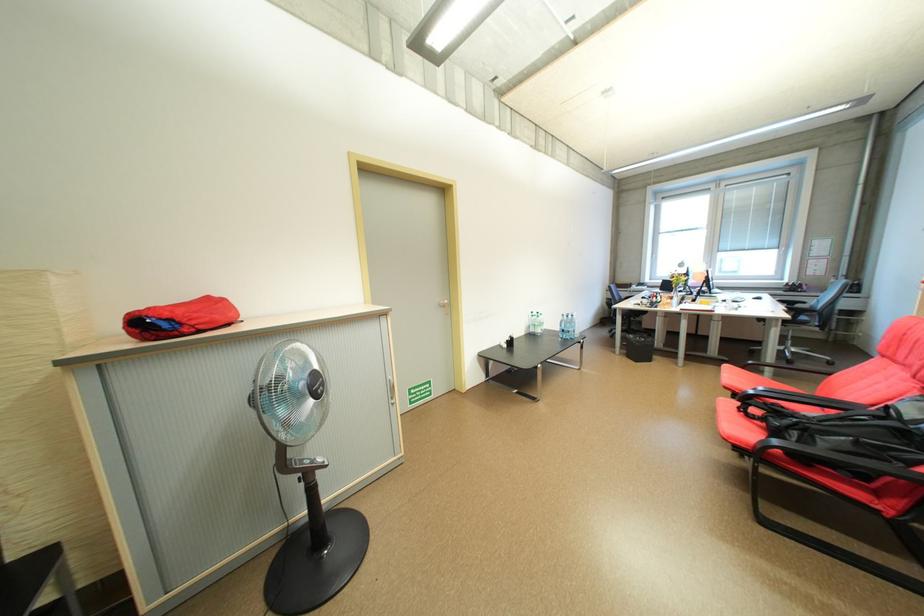
At what (x,y) coordinates should I click in order to perform the action: click on computer keyboard. Please return your answer as a coordinate pair (x, y). The image size is (924, 616). Looking at the image, I should click on (746, 302).